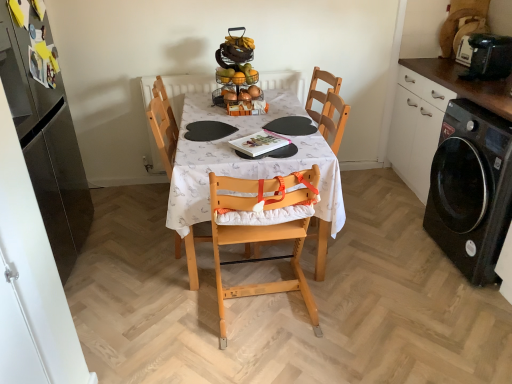
Where is `free spot to the right of light wood highchair at center, which is the 2th chair in left-to-right order`? The image size is (512, 384). free spot to the right of light wood highchair at center, which is the 2th chair in left-to-right order is located at coordinates point(355,297).